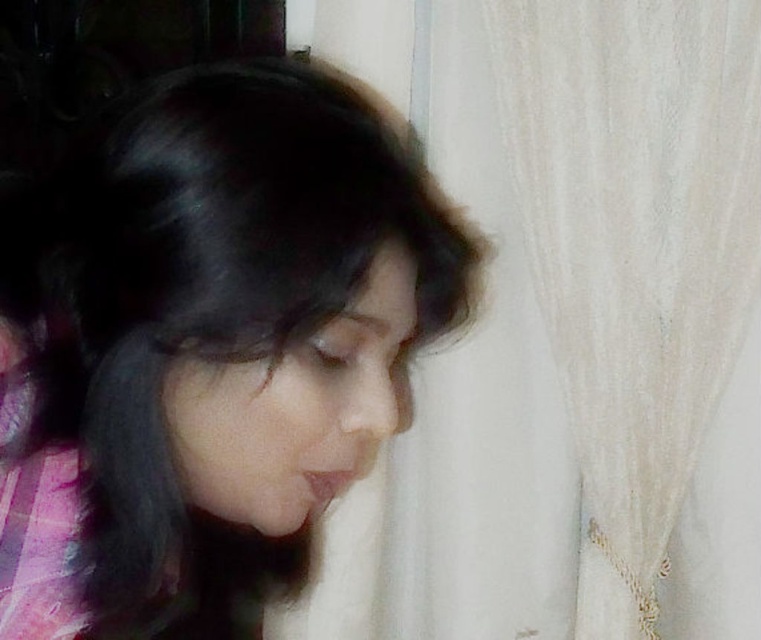
Is white sheer curtain at upper right smaller than smooth black hair at center?

No, white sheer curtain at upper right is not smaller than smooth black hair at center.

Measure the distance between white sheer curtain at upper right and camera.

They are 3.64 feet apart.

Find the location of a particular element. This screenshot has width=761, height=640. white sheer curtain at upper right is located at coordinates (568, 330).

Where is `white sheer curtain at upper right`? white sheer curtain at upper right is located at coordinates (568, 330).